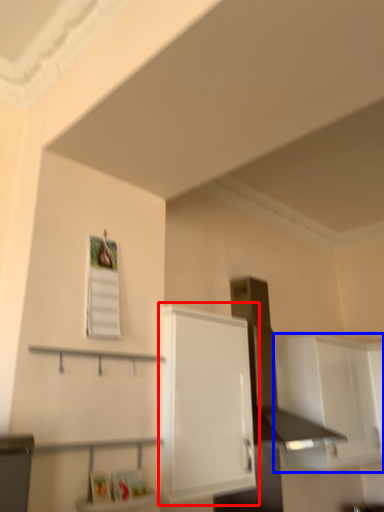
Question: Among these objects, which one is farthest to the camera, cabinetry (highlighted by a red box) or cabinetry (highlighted by a blue box)?

Choices:
 (A) cabinetry
 (B) cabinetry

Answer: (B)